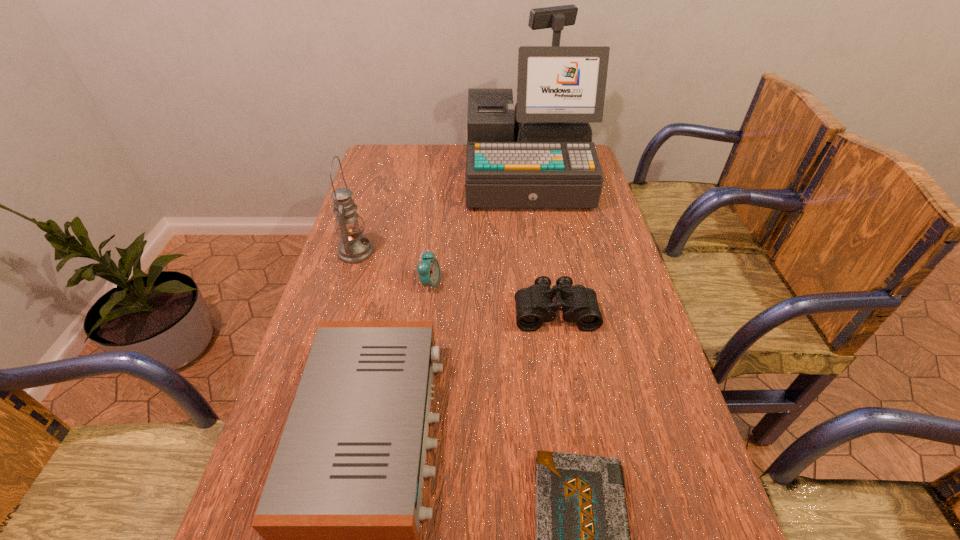
At what (x,y) coordinates should I click in order to perform the action: click on vacant region between the fifth tallest object and the fifth shortest object. Please return your answer as a coordinate pair (x, y). The height and width of the screenshot is (540, 960). Looking at the image, I should click on (455, 281).

Identify the location of unoccupied position between the tallest object and the second tallest object. [x=441, y=213].

At what (x,y) coordinates should I click in order to perform the action: click on empty space between the alarm clock and the binoculars. Please return your answer as a coordinate pair (x, y). Looking at the image, I should click on (492, 298).

Where is `unoccupied area between the cash register and the alarm clock`? This screenshot has width=960, height=540. unoccupied area between the cash register and the alarm clock is located at coordinates (478, 230).

Locate an element on the screen. This screenshot has height=540, width=960. unoccupied area between the binoculars and the fifth nearest object is located at coordinates [455, 281].

What are the coordinates of `object that stands as the closest to the oil lamp` in the screenshot? It's located at (428, 268).

You are a GUI agent. You are given a task and a screenshot of the screen. Output one action in this format:
    pyautogui.click(x=<x>, y=<y>)
    Task: Click on the object that can be found as the second closest to the tallest object
    
    Given the screenshot: What is the action you would take?
    pyautogui.click(x=428, y=268)

Locate an element on the screen. This screenshot has width=960, height=540. vacant point that satisfies the following two spatial constraints: 1. on the customer-facing side of the farthest object; 2. on the face of the alarm clock is located at coordinates (542, 285).